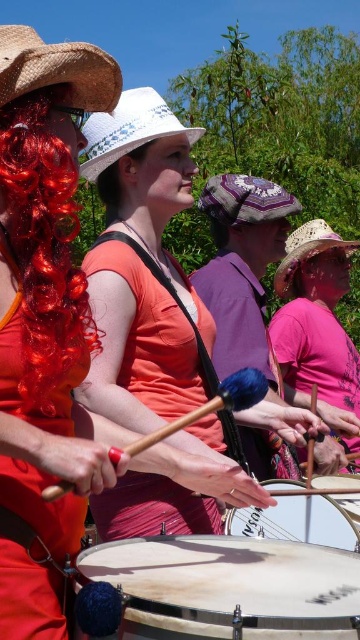
Can you confirm if pink matte shirt at center is positioned to the right of rustic straw cowboy hat at center?

Correct, you'll find pink matte shirt at center to the right of rustic straw cowboy hat at center.

Does pink matte shirt at center have a smaller size compared to rustic straw cowboy hat at center?

No, pink matte shirt at center is not smaller than rustic straw cowboy hat at center.

What do you see at coordinates (316, 317) in the screenshot?
I see `pink matte shirt at center` at bounding box center [316, 317].

Locate an element on the screen. This screenshot has width=360, height=640. pink matte shirt at center is located at coordinates (316, 317).

Is white drum at center wider than smooth white drum at center?

Indeed, white drum at center has a greater width compared to smooth white drum at center.

Who is higher up, white drum at center or smooth white drum at center?

Positioned higher is white drum at center.

Between point (354, 532) and point (343, 496), which one is positioned behind?

Point (343, 496)

Find the location of a particular element. The height and width of the screenshot is (640, 360). white drum at center is located at coordinates (295, 518).

Is smooth wooden drum at center further to the viewer compared to blonde hair at center?

No, smooth wooden drum at center is in front of blonde hair at center.

What do you see at coordinates (231, 586) in the screenshot? This screenshot has height=640, width=360. I see `smooth wooden drum at center` at bounding box center [231, 586].

Which is in front, point (135, 577) or point (140, 145)?

Point (135, 577) is more forward.

This screenshot has width=360, height=640. Find the location of `smooth wooden drum at center`. smooth wooden drum at center is located at coordinates (231, 586).